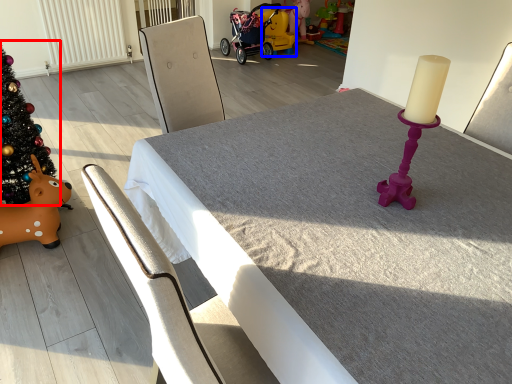
Question: Which object appears farthest to the camera in this image, christmas tree (highlighted by a red box) or toy (highlighted by a blue box)?

Choices:
 (A) christmas tree
 (B) toy

Answer: (B)